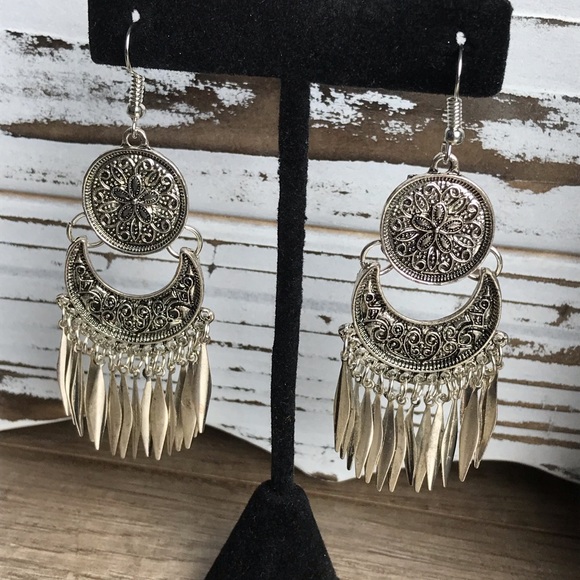
The height and width of the screenshot is (580, 580). What are the coordinates of `hooks` in the screenshot? It's located at (126, 46), (456, 72).